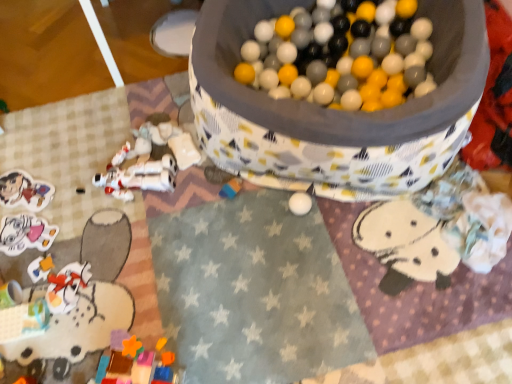
Measure the distance between multicolored plastic blocks at center, the 2th toy positioned from the right, and camera.

multicolored plastic blocks at center, the 2th toy positioned from the right, and camera are 1.36 meters apart from each other.

The image size is (512, 384). Identify the location of plastic toy figure at lower left, positioned as the third toy in left-to-right order. (60, 282).

Identify the location of matte cardboard sticker at lower left, which is the first toy in left-to-right order. Image resolution: width=512 pixels, height=384 pixels. (24, 191).

This screenshot has height=384, width=512. Describe the element at coordinates (439, 227) in the screenshot. I see `fluffy white blanket at lower right, arranged as the 1th toy when viewed from the right` at that location.

The height and width of the screenshot is (384, 512). I want to click on matte white sticker at lower left, which appears as the 2th toy when viewed from the left, so click(x=25, y=234).

From the image's perspective, between matte white sticker at lower left, the 5th toy when ordered from right to left, and fluffy white blanket at lower right, arranged as the 1th toy when viewed from the right, who is located below?

matte white sticker at lower left, the 5th toy when ordered from right to left.

Which of these two, matte white sticker at lower left, the 5th toy when ordered from right to left, or fluffy white blanket at lower right, which appears as the sixth toy when viewed from the left, is bigger?

Bigger between the two is fluffy white blanket at lower right, which appears as the sixth toy when viewed from the left.

At what (x,y) coordinates should I click in order to perform the action: click on toy that is the 3rd one above the matte white sticker at lower left, which appears as the 2th toy when viewed from the left (from a real-world perspective). Please return your answer as a coordinate pair (x, y). The image size is (512, 384). Looking at the image, I should click on (439, 227).

From a real-world perspective, which is physically above, matte white sticker at lower left, the 5th toy when ordered from right to left, or fluffy white blanket at lower right, which appears as the sixth toy when viewed from the left?

fluffy white blanket at lower right, which appears as the sixth toy when viewed from the left, from a real-world perspective.

Does multicolored plastic blocks at center, the 2th toy positioned from the right, have a larger size compared to matte cardboard sticker at lower left, which is the first toy in left-to-right order?

No, multicolored plastic blocks at center, the 2th toy positioned from the right, is not bigger than matte cardboard sticker at lower left, which is the first toy in left-to-right order.

Is multicolored plastic blocks at center, acting as the 5th toy starting from the left, facing towards matte cardboard sticker at lower left, which is the sixth toy from right to left?

No.

Which object is thinner, multicolored plastic blocks at center, acting as the 5th toy starting from the left, or matte cardboard sticker at lower left, which is the first toy in left-to-right order?

multicolored plastic blocks at center, acting as the 5th toy starting from the left.

There is a multicolored plastic blocks at center, the 2th toy positioned from the right. Where is `the 1st toy below it (from the image's perspective)`? the 1st toy below it (from the image's perspective) is located at coordinates (24, 191).

Is matte white sticker at lower left, the 5th toy when ordered from right to left, next to plastic toy figure at lower left, positioned as the third toy in left-to-right order, and touching it?

There is a gap between matte white sticker at lower left, the 5th toy when ordered from right to left, and plastic toy figure at lower left, positioned as the third toy in left-to-right order.

In terms of size, does matte white sticker at lower left, the 5th toy when ordered from right to left, appear bigger or smaller than plastic toy figure at lower left, placed as the fourth toy when sorted from right to left?

In the image, matte white sticker at lower left, the 5th toy when ordered from right to left, appears to be larger than plastic toy figure at lower left, placed as the fourth toy when sorted from right to left.

Between point (8, 223) and point (35, 266), which one is positioned in front?

The point (35, 266) is closer.

Is matte white sticker at lower left, which appears as the 2th toy when viewed from the left, further to the viewer compared to plastic toy figure at lower left, positioned as the third toy in left-to-right order?

Yes, it is behind plastic toy figure at lower left, positioned as the third toy in left-to-right order.

Is point (236, 178) positioned in front of point (81, 282)?

That is False.

Is plastic toy figure at lower left, positioned as the third toy in left-to-right order, surrounded by multicolored plastic blocks at center, acting as the 5th toy starting from the left?

Actually, plastic toy figure at lower left, positioned as the third toy in left-to-right order, is outside multicolored plastic blocks at center, acting as the 5th toy starting from the left.

In the scene shown: Is multicolored plastic blocks at center, acting as the 5th toy starting from the left, closer to camera compared to plastic toy figure at lower left, placed as the fourth toy when sorted from right to left?

No, multicolored plastic blocks at center, acting as the 5th toy starting from the left, is further to the viewer.

From a real-world perspective, who is located higher, multicolored plastic blocks at center, acting as the 5th toy starting from the left, or plastic toy figure at lower left, positioned as the third toy in left-to-right order?

In real-world perspective, multicolored plastic blocks at center, acting as the 5th toy starting from the left, is above.

Based on the photo, from their relative heights in the image, would you say fluffy white blanket at lower right, arranged as the 1th toy when viewed from the right, is taller or shorter than white plastic astronaut at lower left, placed as the 4th toy when sorted from left to right?

In the image, fluffy white blanket at lower right, arranged as the 1th toy when viewed from the right, appears to be taller than white plastic astronaut at lower left, placed as the 4th toy when sorted from left to right.

Which of these two, fluffy white blanket at lower right, arranged as the 1th toy when viewed from the right, or white plastic astronaut at lower left, placed as the 3th toy when sorted from right to left, is thinner?

Thinner between the two is white plastic astronaut at lower left, placed as the 3th toy when sorted from right to left.

Measure the distance between fluffy white blanket at lower right, arranged as the 1th toy when viewed from the right, and white plastic astronaut at lower left, placed as the 3th toy when sorted from right to left.

The distance of fluffy white blanket at lower right, arranged as the 1th toy when viewed from the right, from white plastic astronaut at lower left, placed as the 3th toy when sorted from right to left, is 31.41 inches.

Consider the image. Is fluffy white blanket at lower right, arranged as the 1th toy when viewed from the right, smaller than white plastic astronaut at lower left, placed as the 4th toy when sorted from left to right?

Incorrect, fluffy white blanket at lower right, arranged as the 1th toy when viewed from the right, is not smaller in size than white plastic astronaut at lower left, placed as the 4th toy when sorted from left to right.

From a real-world perspective, is matte white sticker at lower left, which appears as the 2th toy when viewed from the left, positioned under matte cardboard sticker at lower left, which is the first toy in left-to-right order, based on gravity?

No.

Who is more distant, matte white sticker at lower left, which appears as the 2th toy when viewed from the left, or matte cardboard sticker at lower left, which is the first toy in left-to-right order?

Positioned behind is matte cardboard sticker at lower left, which is the first toy in left-to-right order.

Which is further, (11,235) or (35,210)?

The point (35,210) is behind.

From a real-world perspective, starting from the multicolored plastic blocks at center, acting as the 5th toy starting from the left, which toy is the 1st one below it? Please provide its 2D coordinates.

[(25, 234)]

Which is more to the left, multicolored plastic blocks at center, the 2th toy positioned from the right, or matte white sticker at lower left, which appears as the 2th toy when viewed from the left?

From the viewer's perspective, matte white sticker at lower left, which appears as the 2th toy when viewed from the left, appears more on the left side.

In the scene shown: From the image's perspective, which one is positioned higher, multicolored plastic blocks at center, the 2th toy positioned from the right, or matte white sticker at lower left, which appears as the 2th toy when viewed from the left?

From the image's view, multicolored plastic blocks at center, the 2th toy positioned from the right, is above.

The image size is (512, 384). In order to click on the 1st toy below the fluffy white blanket at lower right, arranged as the 1th toy when viewed from the right (from the image's perspective) in this screenshot , I will do `click(25, 234)`.

At what (x,y) coordinates should I click in order to perform the action: click on toy that appears behind the multicolored plastic blocks at center, acting as the 5th toy starting from the left. Please return your answer as a coordinate pair (x, y). This screenshot has height=384, width=512. Looking at the image, I should click on (24, 191).

When comparing their distances from fluffy white blanket at lower right, arranged as the 1th toy when viewed from the right, does matte white sticker at lower left, the 5th toy when ordered from right to left, or plastic toy figure at lower left, placed as the fourth toy when sorted from right to left, seem closer?

Among the two, plastic toy figure at lower left, placed as the fourth toy when sorted from right to left, is located nearer to fluffy white blanket at lower right, arranged as the 1th toy when viewed from the right.

Based on their spatial positions, is plastic toy figure at lower left, placed as the fourth toy when sorted from right to left, or fluffy white blanket at lower right, arranged as the 1th toy when viewed from the right, closer to multicolored plastic blocks at center, the 2th toy positioned from the right?

A: The object closer to multicolored plastic blocks at center, the 2th toy positioned from the right, is plastic toy figure at lower left, placed as the fourth toy when sorted from right to left.

Estimate the real-world distances between objects in this image. Which object is further from white plastic astronaut at lower left, placed as the 4th toy when sorted from left to right, multicolored plastic blocks at center, acting as the 5th toy starting from the left, or fluffy white blanket at lower right, arranged as the 1th toy when viewed from the right?

Based on the image, fluffy white blanket at lower right, arranged as the 1th toy when viewed from the right, appears to be further to white plastic astronaut at lower left, placed as the 4th toy when sorted from left to right.

Which object lies further to the anchor point multicolored plastic blocks at center, the 2th toy positioned from the right, matte white sticker at lower left, the 5th toy when ordered from right to left, or plastic toy figure at lower left, placed as the fourth toy when sorted from right to left?

matte white sticker at lower left, the 5th toy when ordered from right to left, is further to multicolored plastic blocks at center, the 2th toy positioned from the right.

Which object lies further to the anchor point white plastic astronaut at lower left, placed as the 4th toy when sorted from left to right, fluffy white blanket at lower right, which appears as the sixth toy when viewed from the left, or matte cardboard sticker at lower left, which is the sixth toy from right to left?

The object further to white plastic astronaut at lower left, placed as the 4th toy when sorted from left to right, is fluffy white blanket at lower right, which appears as the sixth toy when viewed from the left.

From the picture: From the image, which object appears to be farther from plastic toy figure at lower left, placed as the fourth toy when sorted from right to left, matte white sticker at lower left, which appears as the 2th toy when viewed from the left, or multicolored plastic blocks at center, acting as the 5th toy starting from the left?

Among the two, multicolored plastic blocks at center, acting as the 5th toy starting from the left, is located further to plastic toy figure at lower left, placed as the fourth toy when sorted from right to left.

When comparing their distances from fluffy white blanket at lower right, arranged as the 1th toy when viewed from the right, does matte white sticker at lower left, which appears as the 2th toy when viewed from the left, or matte cardboard sticker at lower left, which is the sixth toy from right to left, seem further?

Based on the image, matte cardboard sticker at lower left, which is the sixth toy from right to left, appears to be further to fluffy white blanket at lower right, arranged as the 1th toy when viewed from the right.

Consider the image. Looking at the image, which one is located closer to fluffy white blanket at lower right, which appears as the sixth toy when viewed from the left, matte cardboard sticker at lower left, which is the sixth toy from right to left, or multicolored plastic blocks at center, acting as the 5th toy starting from the left?

multicolored plastic blocks at center, acting as the 5th toy starting from the left, is positioned closer to the anchor fluffy white blanket at lower right, which appears as the sixth toy when viewed from the left.

This screenshot has height=384, width=512. In order to click on toy between white plastic astronaut at lower left, placed as the 3th toy when sorted from right to left, and fluffy white blanket at lower right, arranged as the 1th toy when viewed from the right, from left to right in this screenshot , I will do `click(231, 188)`.

The image size is (512, 384). I want to click on toy between plastic toy figure at lower left, positioned as the third toy in left-to-right order, and multicolored plastic blocks at center, the 2th toy positioned from the right, in the horizontal direction, so [139, 178].